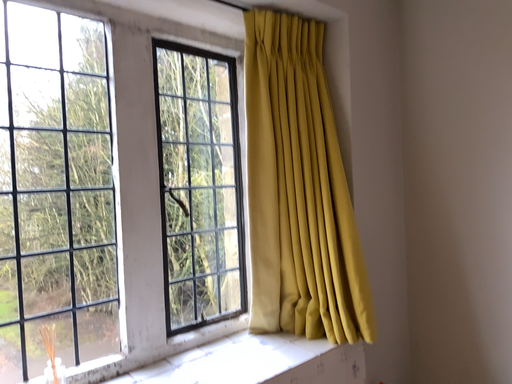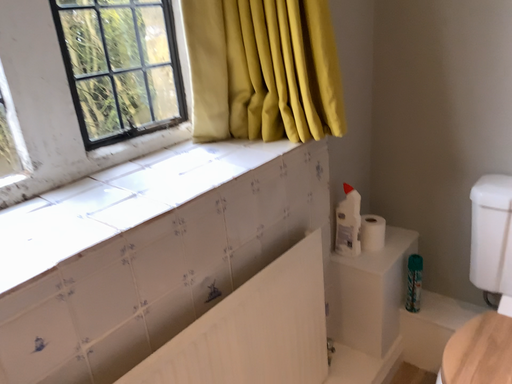
Question: Which way did the camera rotate in the video?

Choices:
 (A) rotated left
 (B) rotated right

Answer: (B)